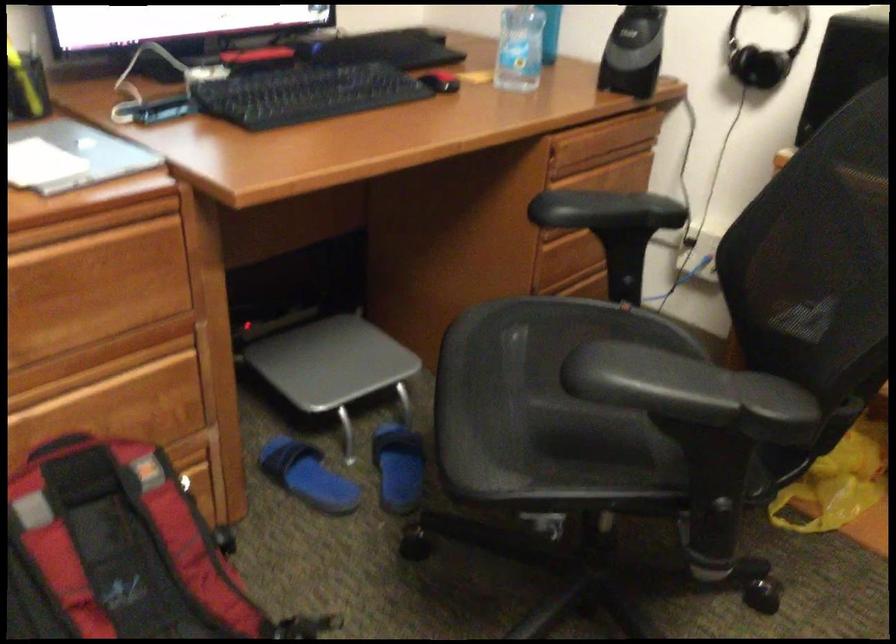
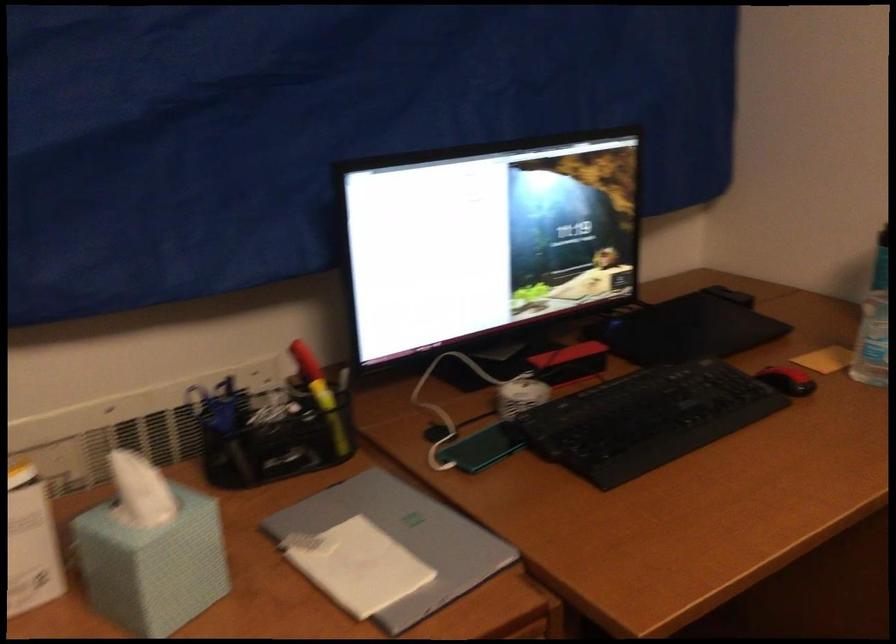
The point at (440, 77) is marked in the first image. Where is the corresponding point in the second image?

(787, 380)